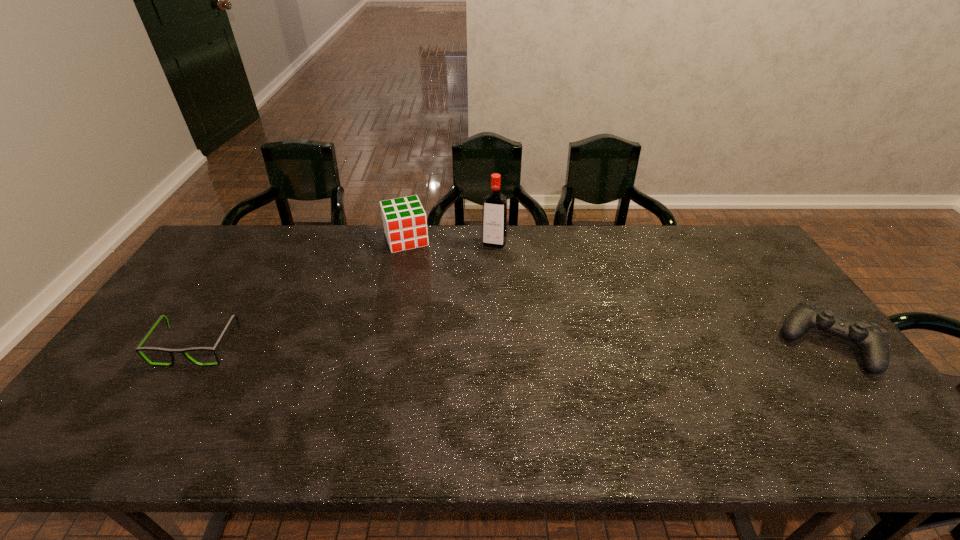
Identify the location of spectacles. The height and width of the screenshot is (540, 960). (171, 351).

The height and width of the screenshot is (540, 960). In order to click on the shortest object in this screenshot , I will do pos(171,351).

The image size is (960, 540). Identify the location of the rightmost object. point(872,339).

Find the location of a particular element. Image resolution: width=960 pixels, height=540 pixels. the second shortest object is located at coordinates (872, 339).

Image resolution: width=960 pixels, height=540 pixels. What are the coordinates of `vodka` in the screenshot? It's located at (495, 204).

Find the location of a particular element. the tallest object is located at coordinates (495, 204).

At what (x,y) coordinates should I click in order to perform the action: click on the third shortest object. Please return your answer as a coordinate pair (x, y). Looking at the image, I should click on (405, 225).

Locate an element on the screen. the third object from right to left is located at coordinates (405, 225).

Where is `vacant space located on the lens of the shortest object`? The height and width of the screenshot is (540, 960). vacant space located on the lens of the shortest object is located at coordinates (158, 411).

Where is `free location located on the left of the second shortest object`? Image resolution: width=960 pixels, height=540 pixels. free location located on the left of the second shortest object is located at coordinates (734, 343).